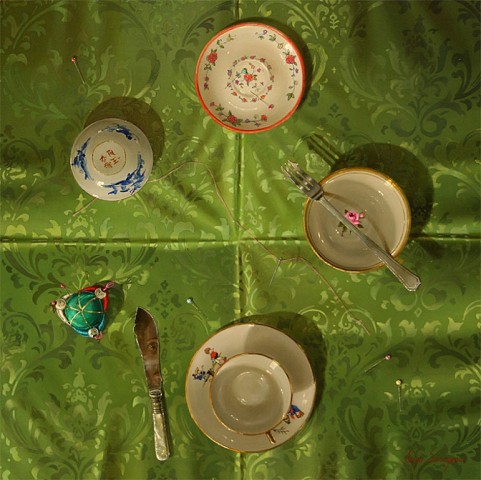
Locate an element on the screen. gold rim of saucer is located at coordinates (232, 450).